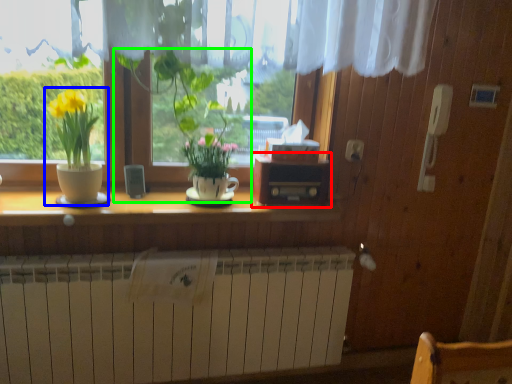
Question: Based on their relative distances, which object is nearer to window box (highlighted by a red box)? Choose from houseplant (highlighted by a blue box) and houseplant (highlighted by a green box).

Choices:
 (A) houseplant
 (B) houseplant

Answer: (B)